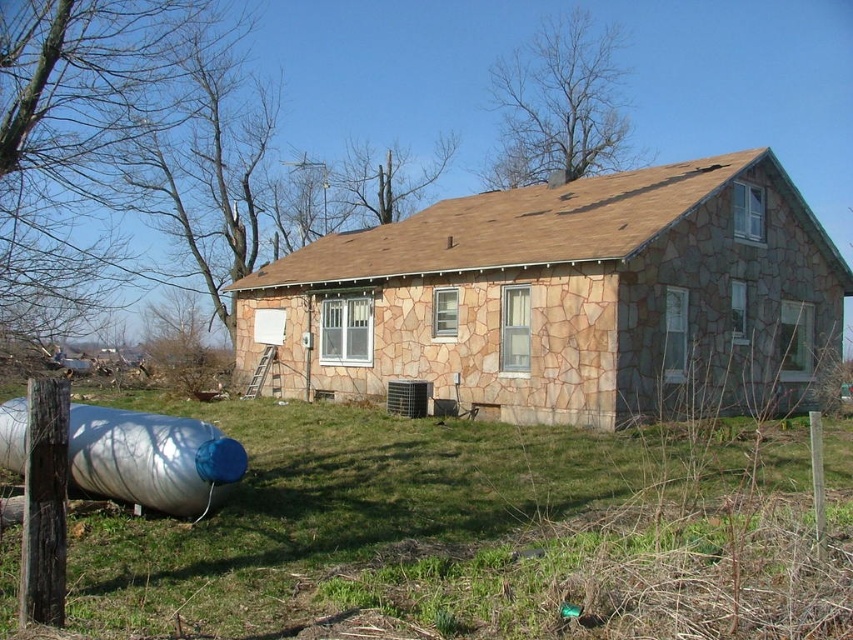
Which of these two, green grass at lower center or stone textured house at center, stands taller?

stone textured house at center

Does point (399, 627) come in front of point (630, 273)?

Yes, it is in front of point (630, 273).

The width and height of the screenshot is (853, 640). In order to click on green grass at lower center in this screenshot , I will do [x=480, y=536].